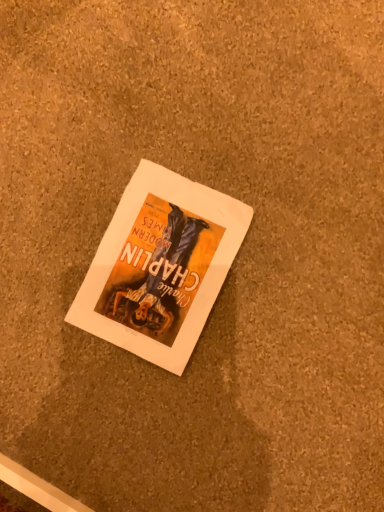
Identify the location of free region under matte paper book at center (from a real-world perspective). (158, 260).